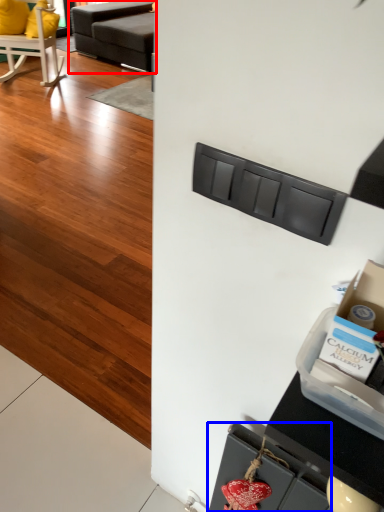
Question: Which object appears closest to the camera in this image, studio couch (highlighted by a red box) or drawer (highlighted by a blue box)?

Choices:
 (A) studio couch
 (B) drawer

Answer: (B)